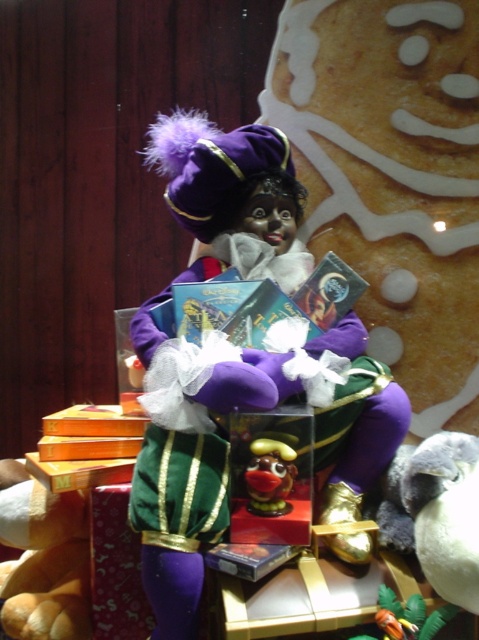
You are a toy store manager who needs to place a new shelf between the purple velvet doll at center and the white plush teddy bear at lower left. The shelf is 12 inches wide. Will the shelf fit between them without overlapping either toy?

The distance between the purple velvet doll at center and the white plush teddy bear at lower left is 14.63 inches. Since the shelf is only 12 inches wide, there is enough space to place it between them without overlapping either toy.

You are a child who wants to place a small toy car between the white plush teddy bear at lower left and the rubber duck at center. According to the image, is there enough space to fit the toy car which is 15 inches long?

The distance between the white plush teddy bear at lower left and the rubber duck at center is 17.07 inches. Since the toy car is 15 inches long, there is enough space to fit it between them.

You are at a holiday fair and see the purple velvet doll at center and the rubber duck at center displayed on the same shelf. Which one is taller?

The purple velvet doll at center is taller than the rubber duck at center.